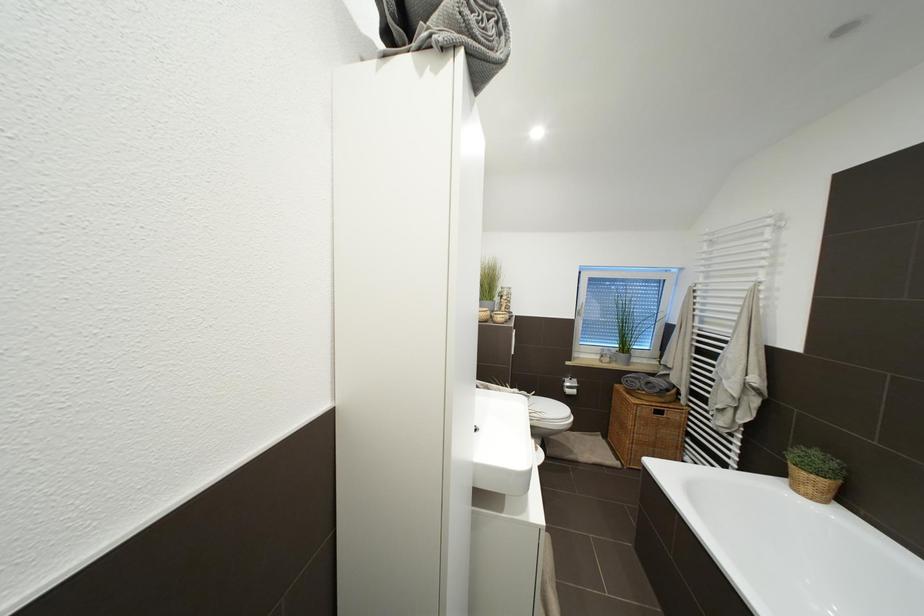
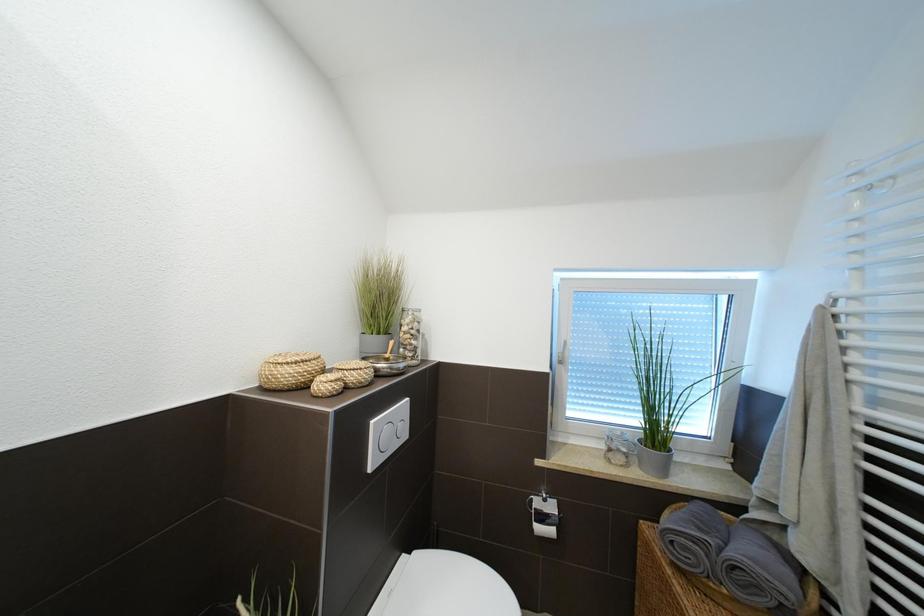
Which direction would the cameraman need to move to produce the second image?

The movement direction of the cameraman is right, forward.